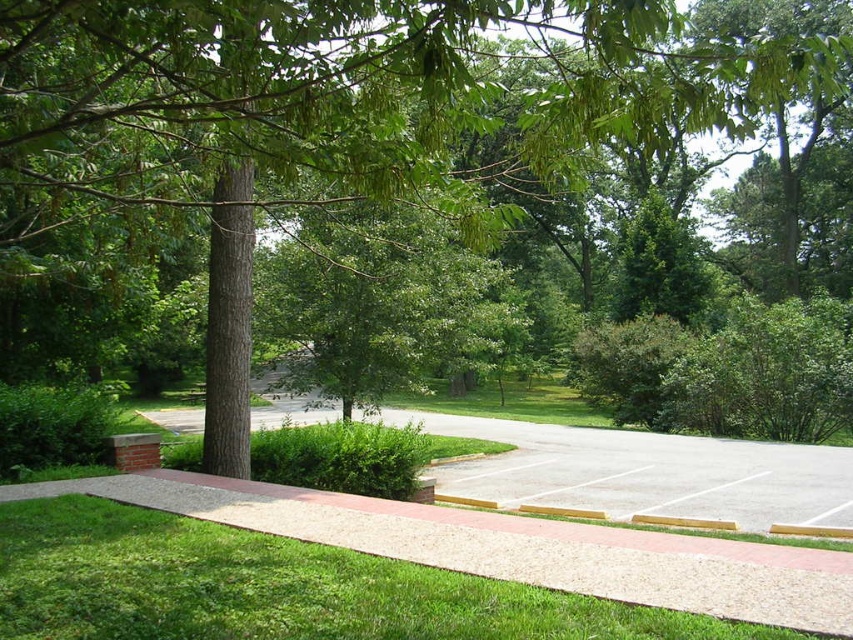
Question: Is green grass at lower left above gray asphalt parking lot at center?

Choices:
 (A) yes
 (B) no

Answer: (A)

Question: Does green grass at lower left appear on the left side of gray asphalt parking lot at center?

Choices:
 (A) no
 (B) yes

Answer: (B)

Question: Is green grass at lower left smaller than gray asphalt parking lot at center?

Choices:
 (A) no
 (B) yes

Answer: (B)

Question: Which point is farther to the camera?

Choices:
 (A) (790, 477)
 (B) (437, 579)

Answer: (A)

Question: Among these objects, which one is nearest to the camera?

Choices:
 (A) green grass at lower left
 (B) gray asphalt parking lot at center

Answer: (A)

Question: Which point is closer to the camera?

Choices:
 (A) green grass at lower left
 (B) gray asphalt parking lot at center

Answer: (A)